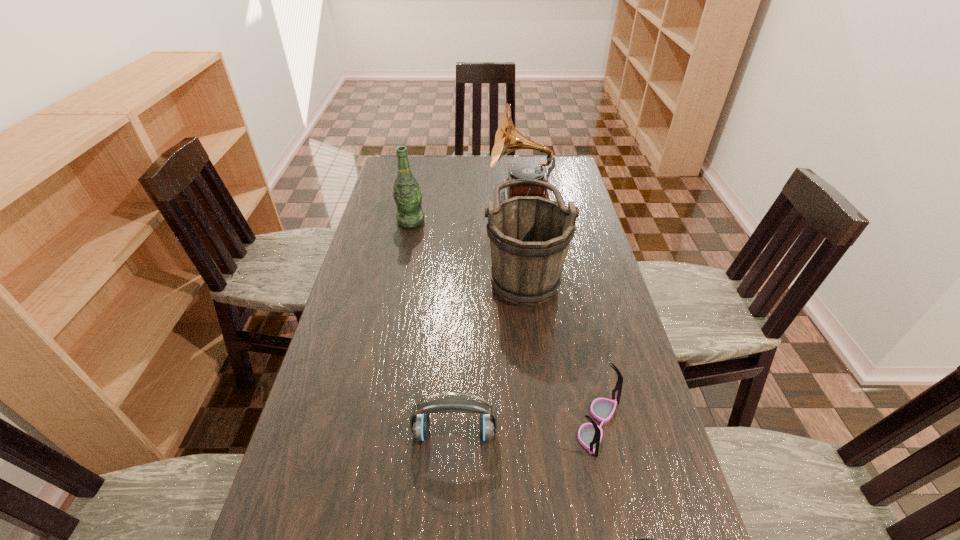
At what (x,y) coordinates should I click in order to perform the action: click on spectacles located at the right edge. Please return your answer as a coordinate pair (x, y). Looking at the image, I should click on (590, 434).

Where is `object situated at the far right corner`? The height and width of the screenshot is (540, 960). object situated at the far right corner is located at coordinates (507, 139).

Identify the location of free region at the far edge of the desktop. (495, 180).

What are the coordinates of `vacant space at the left edge` in the screenshot? It's located at (363, 248).

Find the location of a particular element. The image size is (960, 540). vacant space at the right edge of the desktop is located at coordinates (599, 248).

In the image, there is a desktop. Identify the location of free space at the far left corner. (395, 166).

In the image, there is a desktop. Where is `vacant space at the far right corner`? vacant space at the far right corner is located at coordinates (569, 164).

The height and width of the screenshot is (540, 960). Identify the location of free space between the headset and the beer bottle. (433, 327).

Locate an element on the screen. Image resolution: width=960 pixels, height=540 pixels. vacant region between the farthest object and the headset is located at coordinates (x=488, y=313).

I want to click on vacant space in between the headset and the third farthest object, so click(x=490, y=352).